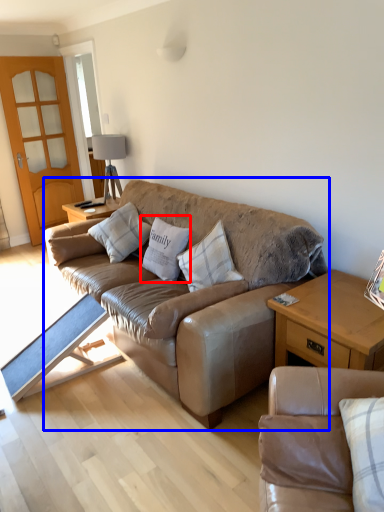
Question: Which object appears closest to the camera in this image, pillow (highlighted by a red box) or studio couch (highlighted by a blue box)?

Choices:
 (A) pillow
 (B) studio couch

Answer: (B)